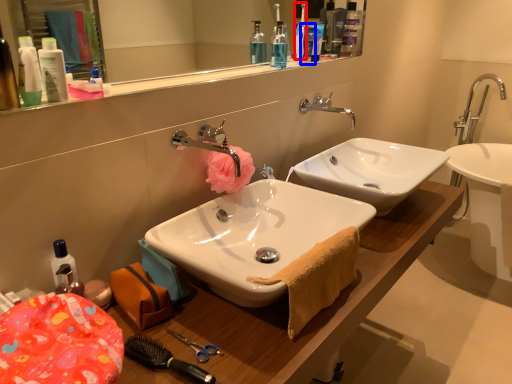
Question: Which point is closer to the camera, toothbrush (highlighted by a red box) or toiletry (highlighted by a blue box)?

Choices:
 (A) toothbrush
 (B) toiletry

Answer: (A)